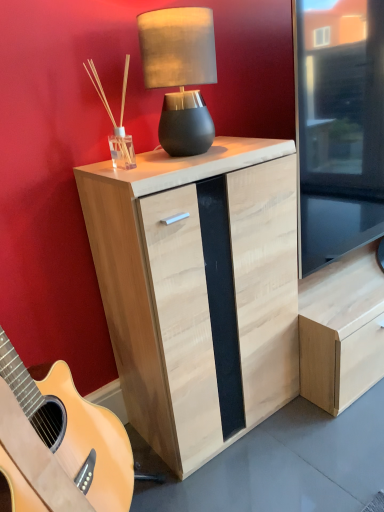
What is the approximate height of natural wood cabinet at center?

natural wood cabinet at center is 34.21 inches tall.

At what (x,y) coordinates should I click in order to perform the action: click on natural wood cabinet at center. Please return your answer as a coordinate pair (x, y). Looking at the image, I should click on (198, 290).

Describe the element at coordinates (198, 290) in the screenshot. The height and width of the screenshot is (512, 384). I see `natural wood cabinet at center` at that location.

What do you see at coordinates (180, 74) in the screenshot? I see `matte black lamp at upper center` at bounding box center [180, 74].

Locate an element on the screen. The height and width of the screenshot is (512, 384). matte black lamp at upper center is located at coordinates (180, 74).

The image size is (384, 512). I want to click on natural wood cabinet at center, so click(x=198, y=290).

Looking at this image, considering the relative positions of natural wood cabinet at center and matte black lamp at upper center in the image provided, is natural wood cabinet at center to the left of matte black lamp at upper center from the viewer's perspective?

Incorrect, natural wood cabinet at center is not on the left side of matte black lamp at upper center.

Which is in front, natural wood cabinet at center or matte black lamp at upper center?

natural wood cabinet at center is in front.

Is point (152, 377) farther from viewer compared to point (192, 58)?

Yes, point (152, 377) is farther from viewer.

From the image's perspective, who appears lower, natural wood cabinet at center or matte black lamp at upper center?

natural wood cabinet at center appears lower in the image.

From a real-world perspective, who is located higher, natural wood cabinet at center or matte black lamp at upper center?

In real-world perspective, matte black lamp at upper center is above.

Which of these two, natural wood cabinet at center or matte black lamp at upper center, is thinner?

Thinner between the two is matte black lamp at upper center.

Considering the relative sizes of natural wood cabinet at center and matte black lamp at upper center in the image provided, is natural wood cabinet at center taller than matte black lamp at upper center?

Yes.

Can you confirm if natural wood cabinet at center is bigger than matte black lamp at upper center?

Indeed, natural wood cabinet at center has a larger size compared to matte black lamp at upper center.

In the scene shown: Is natural wood cabinet at center situated inside matte black lamp at upper center or outside?

The correct answer is: outside.

Is natural wood cabinet at center with matte black lamp at upper center?

No, natural wood cabinet at center is not next to matte black lamp at upper center.

Could you tell me if natural wood cabinet at center is facing matte black lamp at upper center?

No.

In order to click on chest of drawers that appears on the right of matte black lamp at upper center in this screenshot , I will do `click(198, 290)`.

Which is more to the right, matte black lamp at upper center or natural wood cabinet at center?

natural wood cabinet at center is more to the right.

Is matte black lamp at upper center positioned in front of natural wood cabinet at center?

No, matte black lamp at upper center is further to the viewer.

Which point is more forward, (177, 60) or (182, 388)?

The point (177, 60) is closer to the camera.

From the image's perspective, is matte black lamp at upper center below natural wood cabinet at center?

No, from the image's perspective, matte black lamp at upper center is not beneath natural wood cabinet at center.

From a real-world perspective, is matte black lamp at upper center on top of natural wood cabinet at center?

Yes, from a real-world perspective, matte black lamp at upper center is over natural wood cabinet at center

Does matte black lamp at upper center have a greater width compared to natural wood cabinet at center?

In fact, matte black lamp at upper center might be narrower than natural wood cabinet at center.

Between matte black lamp at upper center and natural wood cabinet at center, which one has less height?

Standing shorter between the two is matte black lamp at upper center.

Which of these two, matte black lamp at upper center or natural wood cabinet at center, is bigger?

With larger size is natural wood cabinet at center.

Does matte black lamp at upper center contain natural wood cabinet at center?

No, matte black lamp at upper center does not contain natural wood cabinet at center.

Is there a large distance between matte black lamp at upper center and natural wood cabinet at center?

No.

Does matte black lamp at upper center turn towards natural wood cabinet at center?

No, matte black lamp at upper center does not turn towards natural wood cabinet at center.

How distant is matte black lamp at upper center from natural wood cabinet at center?

matte black lamp at upper center is 14.46 inches from natural wood cabinet at center.

At what (x,y) coordinates should I click in order to perform the action: click on lamp above the natural wood cabinet at center (from a real-world perspective). Please return your answer as a coordinate pair (x, y). Looking at the image, I should click on (180, 74).

Where is `chest of drawers on the right of matte black lamp at upper center`? The image size is (384, 512). chest of drawers on the right of matte black lamp at upper center is located at coordinates (198, 290).

The image size is (384, 512). I want to click on lamp to the left of natural wood cabinet at center, so click(x=180, y=74).